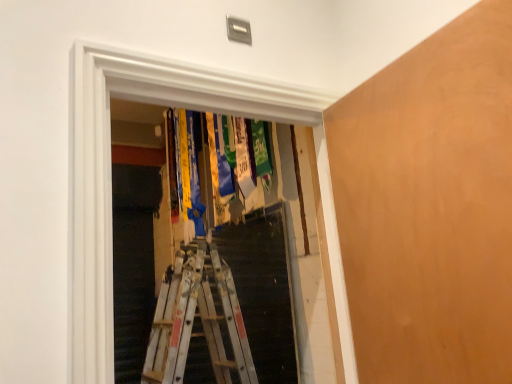
Question: Is transparent plastic medals at center inside or outside of smooth orange plywood at right?

Choices:
 (A) outside
 (B) inside

Answer: (A)

Question: Looking at their shapes, would you say transparent plastic medals at center is wider or thinner than smooth orange plywood at right?

Choices:
 (A) wide
 (B) thin

Answer: (A)

Question: Which of these objects is positioned closest to the smooth orange plywood at right?

Choices:
 (A) transparent plastic medals at center
 (B) metallic silver ladder at center

Answer: (A)

Question: Which is nearer to the metallic silver ladder at center?

Choices:
 (A) smooth orange plywood at right
 (B) transparent plastic medals at center

Answer: (A)